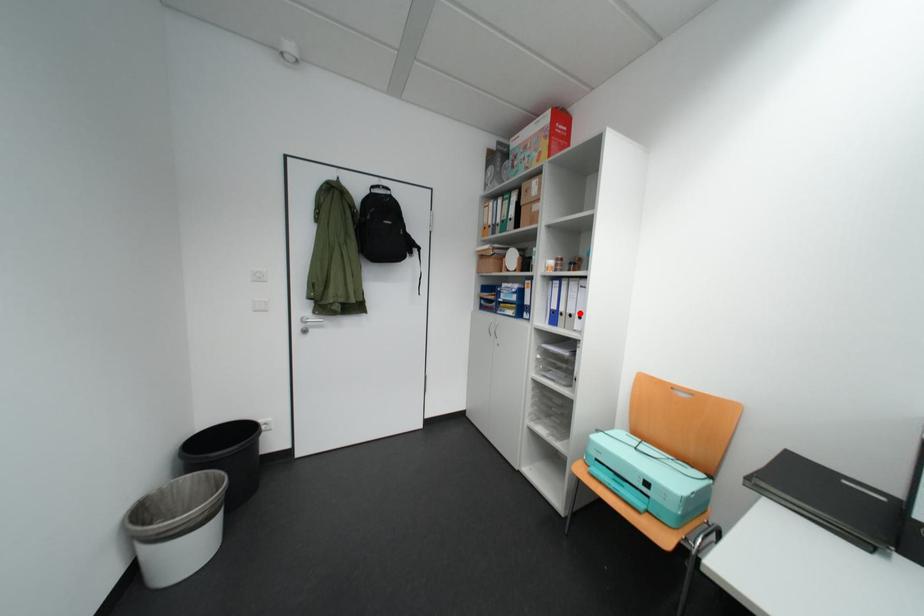
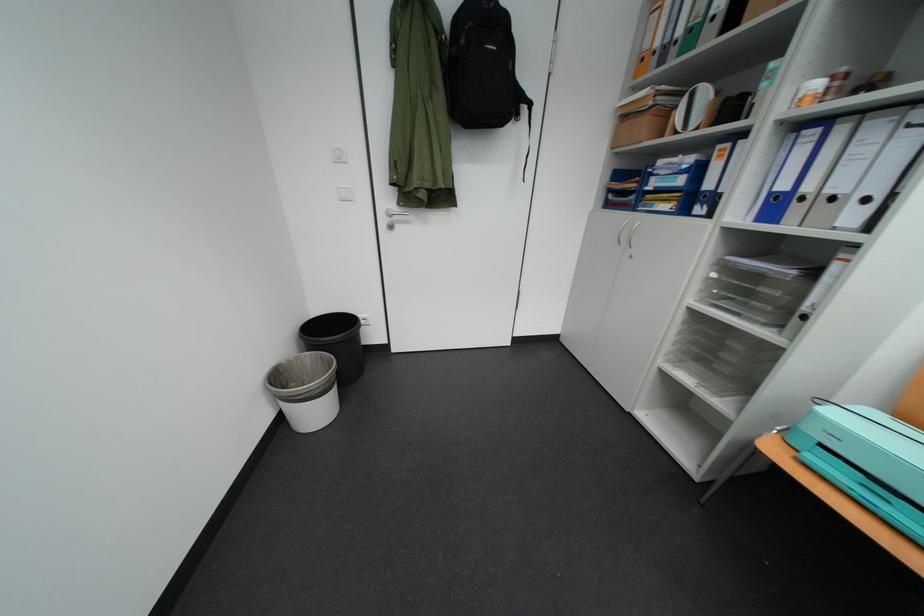
Locate, in the second image, the point that corresponds to the highlighted location in the first image.

(841, 193)